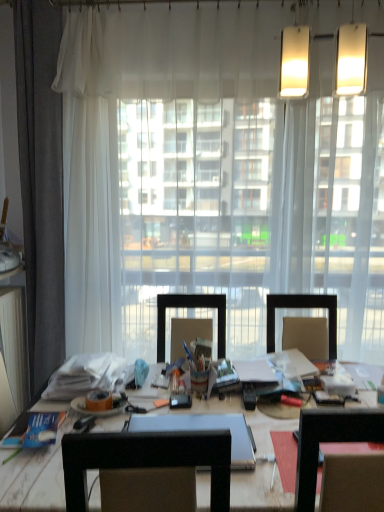
Where is `vacant region in front of blue paper book at lower left`? vacant region in front of blue paper book at lower left is located at coordinates (26, 465).